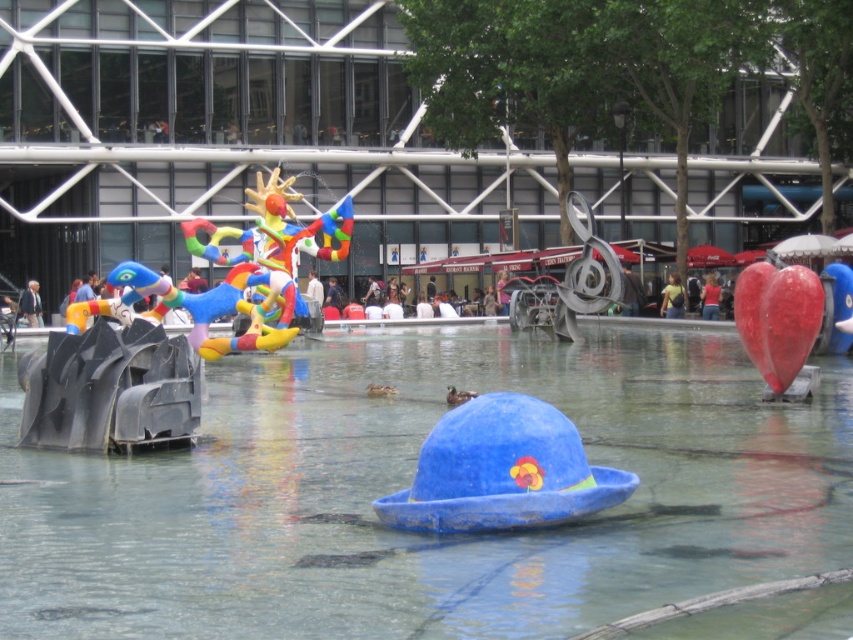
Based on the scene description, where is the transparent plastic water at center located in terms of its 2D coordinates?

The transparent plastic water at center is located at the 2D coordinates point (407, 484).

You are a tourist visiting the fountain area and want to take a photo of both the blue felt hat at center and the rubber heart at right. Based on their positions, which object should you focus on first to ensure both are in the frame?

Since the blue felt hat at center is located below the rubber heart at right, you should focus on the rubber heart at right first to ensure both objects are within the camera frame.